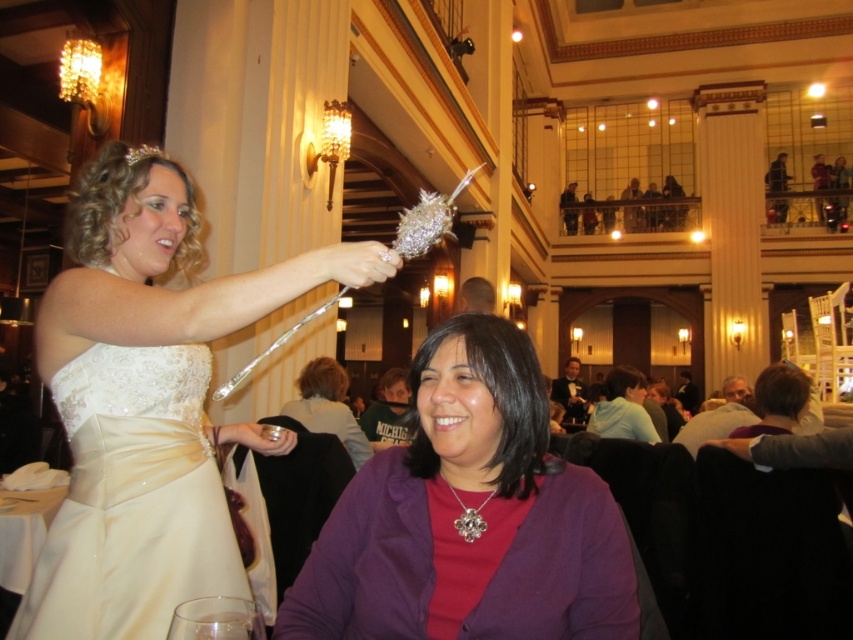
You are a photographer at the event and need to capture a photo that includes both the purple matte blazer at center and the ivory satin dress at upper left. The camera has a maximum focus range of 1.5 meters. Will you be able to fit both items within the camera frame?

The purple matte blazer at center and ivory satin dress at upper left are 1.39 meters apart from each other. Since the distance between them is less than the camera maximum focus range of 1.5 meters, both items can be captured in the same frame.

Based on the photo, where is the matte white dress at center located in the image?

The matte white dress at center is located at point coordinates of 0.627 on the x axis and 0.175 on the y axis.